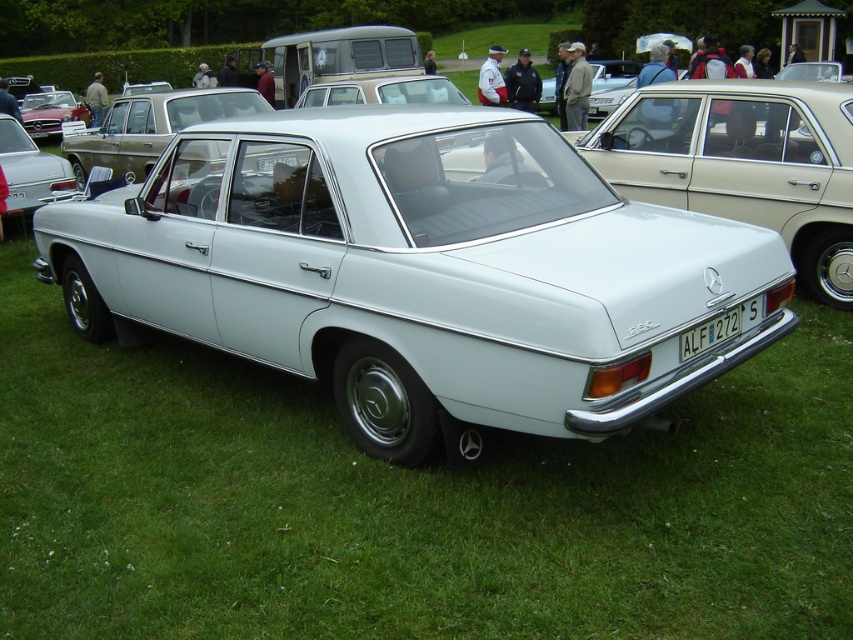
You are a photographer at a car show and need to capture both the metallic red convertible at upper left and the white plastic license plate at center in a single shot. Considering their sizes, will you need to adjust your camera to a wider angle to ensure both fit in the frame?

The metallic red convertible at upper left is bigger than the white plastic license plate at center, so to capture both in a single shot, you might need to use a wider angle to accommodate the larger size of the metallic red convertible at upper left.

You are a photographer trying to capture the metallic red convertible at upper left and the white plastic license plate at center in the same frame. Which object should you focus on first if you want to ensure both are in focus without adjusting your camera settings?

The metallic red convertible at upper left has a greater height compared to the white plastic license plate at center. Since the convertible is taller, you should focus on it first to ensure both are in focus.

You are standing in front of the Mercedes 250 car at the car show. You notice two points marked on the car. One is at coordinate point (42, 99) and the other is at point (762, 310). Which point is closer to you?

Point (42, 99) is closer to you because it is further to the camera than point (762, 310).